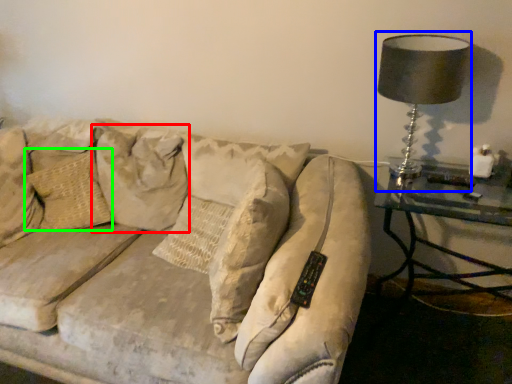
Question: Considering the real-world distances, which object is farthest from pillow (highlighted by a red box)? table lamp (highlighted by a blue box) or pillow (highlighted by a green box)?

Choices:
 (A) table lamp
 (B) pillow

Answer: (A)